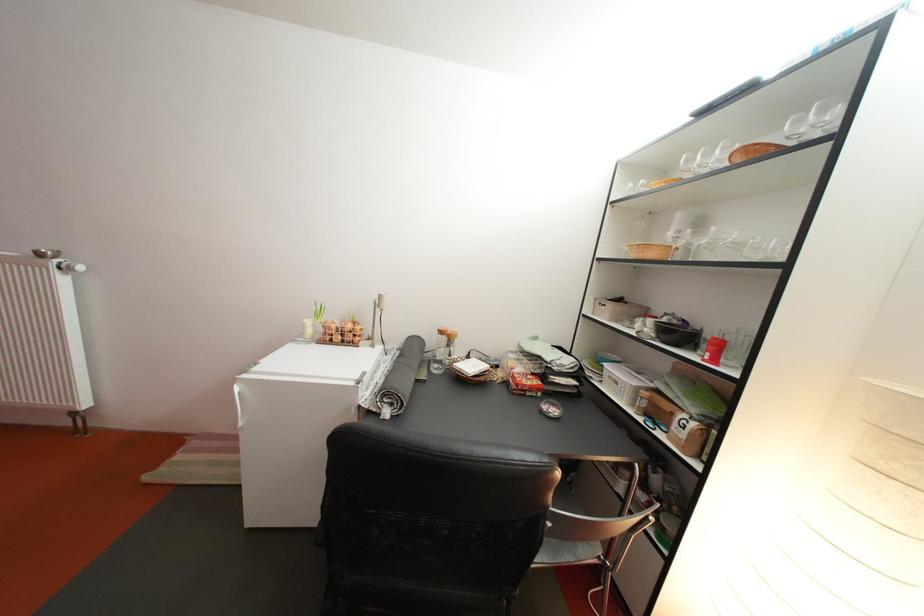
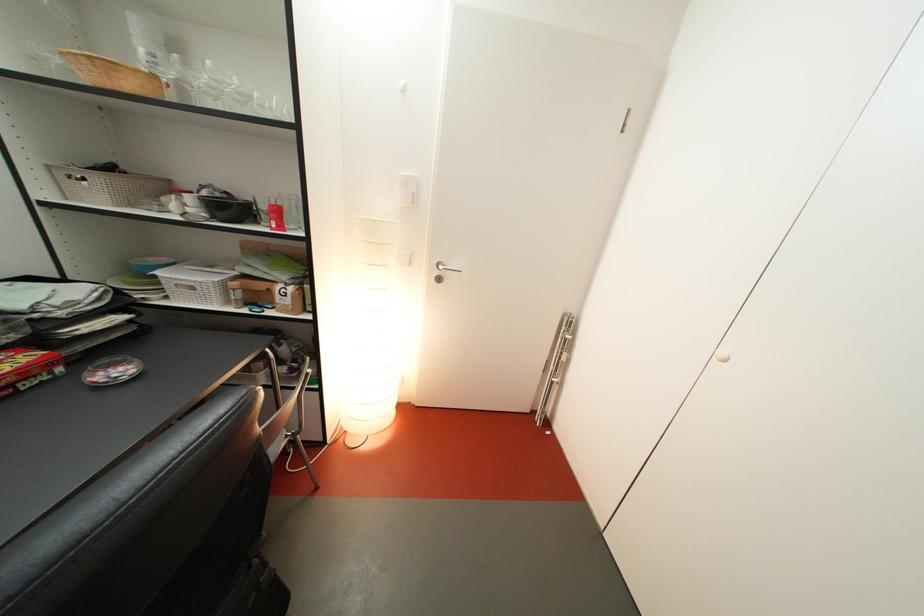
Find the pixel in the second image that matches pixel 565 416 in the first image.

(131, 376)